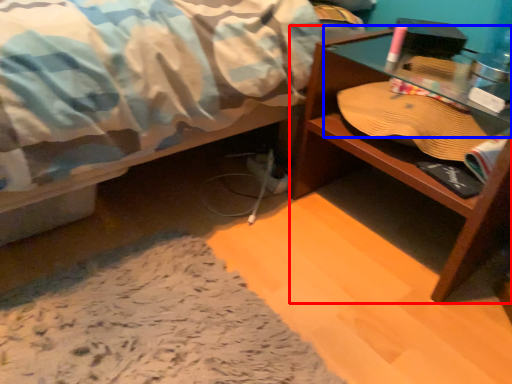
Question: Which object appears farthest to the camera in this image, desk (highlighted by a red box) or glass table (highlighted by a blue box)?

Choices:
 (A) desk
 (B) glass table

Answer: (B)